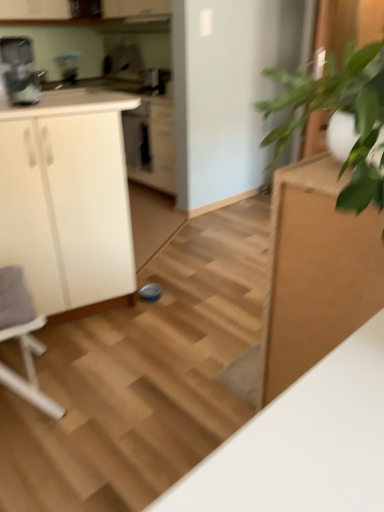
Question: Is metallic silver coffee machine at upper left facing away from satin black coffee maker at upper center?

Choices:
 (A) no
 (B) yes

Answer: (A)

Question: Can we say metallic silver coffee machine at upper left lies outside satin black coffee maker at upper center?

Choices:
 (A) no
 (B) yes

Answer: (B)

Question: From a real-world perspective, is metallic silver coffee machine at upper left on top of satin black coffee maker at upper center?

Choices:
 (A) no
 (B) yes

Answer: (B)

Question: Considering the relative positions of metallic silver coffee machine at upper left and satin black coffee maker at upper center in the image provided, is metallic silver coffee machine at upper left in front of satin black coffee maker at upper center?

Choices:
 (A) yes
 (B) no

Answer: (A)

Question: From the image's perspective, is metallic silver coffee machine at upper left on top of satin black coffee maker at upper center?

Choices:
 (A) no
 (B) yes

Answer: (A)

Question: Is metallic silver coffee machine at upper left taller than satin black coffee maker at upper center?

Choices:
 (A) yes
 (B) no

Answer: (A)

Question: Is white matte cabinet at left smaller than metallic silver coffee machine at upper left?

Choices:
 (A) yes
 (B) no

Answer: (B)

Question: Can you confirm if white matte cabinet at left is bigger than metallic silver coffee machine at upper left?

Choices:
 (A) yes
 (B) no

Answer: (A)

Question: Is white matte cabinet at left aimed at metallic silver coffee machine at upper left?

Choices:
 (A) no
 (B) yes

Answer: (A)

Question: Is white matte cabinet at left surrounding metallic silver coffee machine at upper left?

Choices:
 (A) no
 (B) yes

Answer: (A)

Question: Can you confirm if white matte cabinet at left is shorter than metallic silver coffee machine at upper left?

Choices:
 (A) no
 (B) yes

Answer: (A)

Question: From a real-world perspective, is white matte cabinet at left positioned under metallic silver coffee machine at upper left based on gravity?

Choices:
 (A) no
 (B) yes

Answer: (B)

Question: Is green leafy plant at right not near wooden stair at center?

Choices:
 (A) no
 (B) yes

Answer: (B)